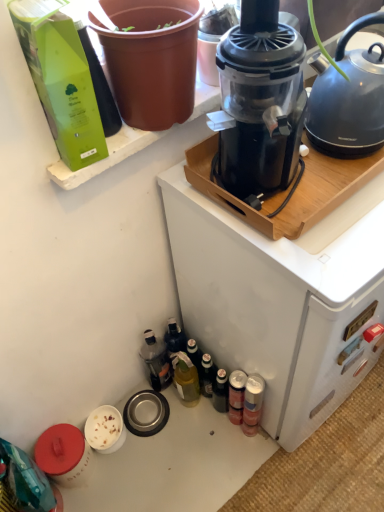
At what (x,y) coordinates should I click in order to perform the action: click on metallic silver can at lower right, which ranks as the third bottle in left-to-right order. Please return your answer as a coordinate pair (x, y). This screenshot has height=512, width=384. Looking at the image, I should click on (236, 396).

In order to face black plastic coffee maker at upper center, should I rotate leftwards or rightwards?

You should rotate right by 13.134 degrees.

At what (x,y) coordinates should I click in order to perform the action: click on transparent plastic juicer at upper center. Please return your answer as a coordinate pair (x, y). Image resolution: width=384 pixels, height=512 pixels. Looking at the image, I should click on (261, 99).

This screenshot has height=512, width=384. I want to click on translucent plastic bottle at lower left, the 1th bottle in the left-to-right sequence, so click(x=156, y=361).

Describe the element at coordinates (253, 403) in the screenshot. I see `metallic silver can at lower right, arranged as the first bottle when viewed from the right` at that location.

Measure the distance between point (194, 384) and camera.

They are 1.44 meters apart.

Identify the location of metallic silver can at lower right, the 2th bottle in the right-to-left sequence. (236, 396).

Between brown matte flowerpot at upper left and matte gray kettle at upper right, which one appears on the right side from the viewer's perspective?

From the viewer's perspective, matte gray kettle at upper right appears more on the right side.

Is brown matte flowerpot at upper left in contact with matte gray kettle at upper right?

brown matte flowerpot at upper left is not next to matte gray kettle at upper right, and they're not touching.

In the scene shown: Which is behind, brown matte flowerpot at upper left or matte gray kettle at upper right?

matte gray kettle at upper right is further from the camera.

From a real-world perspective, which is physically below, translucent plastic bottle at lower left, placed as the fourth bottle when sorted from right to left, or metallic silver can at lower right, the 2th bottle in the right-to-left sequence?

metallic silver can at lower right, the 2th bottle in the right-to-left sequence, is physically lower.

Can you tell me how much translucent plastic bottle at lower left, the 1th bottle in the left-to-right sequence, and metallic silver can at lower right, which ranks as the third bottle in left-to-right order, differ in facing direction?

0.00205 degrees separate the facing orientations of translucent plastic bottle at lower left, the 1th bottle in the left-to-right sequence, and metallic silver can at lower right, which ranks as the third bottle in left-to-right order.

Which is in front, translucent plastic bottle at lower left, placed as the fourth bottle when sorted from right to left, or metallic silver can at lower right, the 2th bottle in the right-to-left sequence?

metallic silver can at lower right, the 2th bottle in the right-to-left sequence, is closer to the camera.

From the image's perspective, is translucent plastic bottle at lower left, placed as the fourth bottle when sorted from right to left, over metallic silver can at lower right, which ranks as the third bottle in left-to-right order?

Yes.

Is metallic silver can at lower right, arranged as the first bottle when viewed from the right, touching translucent plastic bottle at lower left, placed as the fourth bottle when sorted from right to left?

No, metallic silver can at lower right, arranged as the first bottle when viewed from the right, is not making contact with translucent plastic bottle at lower left, placed as the fourth bottle when sorted from right to left.

Is metallic silver can at lower right, arranged as the first bottle when viewed from the right, shorter than translucent plastic bottle at lower left, the 1th bottle in the left-to-right sequence?

No, metallic silver can at lower right, arranged as the first bottle when viewed from the right, is not shorter than translucent plastic bottle at lower left, the 1th bottle in the left-to-right sequence.

Image resolution: width=384 pixels, height=512 pixels. In order to click on the 3rd bottle below when counting from the translucent plastic bottle at lower left, the 1th bottle in the left-to-right sequence (from the image's perspective) in this screenshot , I will do `click(253, 403)`.

Can you confirm if metallic silver can at lower right, arranged as the first bottle when viewed from the right, is thinner than translucent plastic bottle at lower left, placed as the fourth bottle when sorted from right to left?

Yes, metallic silver can at lower right, arranged as the first bottle when viewed from the right, is thinner than translucent plastic bottle at lower left, placed as the fourth bottle when sorted from right to left.

Can you confirm if brown matte flowerpot at upper left is bigger than transparent plastic juicer at upper center?

Incorrect, brown matte flowerpot at upper left is not larger than transparent plastic juicer at upper center.

In the scene shown: Can you confirm if brown matte flowerpot at upper left is positioned to the right of transparent plastic juicer at upper center?

Incorrect, brown matte flowerpot at upper left is not on the right side of transparent plastic juicer at upper center.

Is brown matte flowerpot at upper left positioned with its back to transparent plastic juicer at upper center?

No, transparent plastic juicer at upper center is not at the back of brown matte flowerpot at upper left.

In terms of width, does brown matte flowerpot at upper left look wider or thinner when compared to transparent plastic juicer at upper center?

Clearly, brown matte flowerpot at upper left has less width compared to transparent plastic juicer at upper center.

Is black plastic coffee maker at upper center behind translucent plastic bottle at lower left, the 1th bottle in the left-to-right sequence?

No.

Can you confirm if black plastic coffee maker at upper center is shorter than translucent plastic bottle at lower left, the 1th bottle in the left-to-right sequence?

No.

Is point (190, 318) positioned before point (144, 336)?

Yes, it is in front of point (144, 336).

Between black plastic coffee maker at upper center and translucent plastic bottle at lower left, placed as the fourth bottle when sorted from right to left, which one has larger width?

With larger width is black plastic coffee maker at upper center.

Who is shorter, metallic silver can at lower right, the 2th bottle in the right-to-left sequence, or matte gray kettle at upper right?

matte gray kettle at upper right is shorter.

Which is in front, point (233, 410) or point (363, 82)?

The point (363, 82) is in front.

Image resolution: width=384 pixels, height=512 pixels. In order to click on kettle lying on the right of metallic silver can at lower right, the 2th bottle in the right-to-left sequence in this screenshot , I will do `click(348, 98)`.

Can you confirm if metallic silver can at lower right, which ranks as the third bottle in left-to-right order, is wider than matte gray kettle at upper right?

No, metallic silver can at lower right, which ranks as the third bottle in left-to-right order, is not wider than matte gray kettle at upper right.

Which is nearer, (x=180, y=369) or (x=181, y=282)?

The point (x=181, y=282) is more forward.

At what (x,y) coordinates should I click in order to perform the action: click on appliance that appears above the green glass bottle at lower center, which is counted as the 2th bottle, starting from the left (from the image's perspective). Please return your answer as a coordinate pair (x, y). Looking at the image, I should click on (278, 295).

From a real-world perspective, is green glass bottle at lower center, which is counted as the 2th bottle, starting from the left, physically located above or below black plastic coffee maker at upper center?

green glass bottle at lower center, which is counted as the 2th bottle, starting from the left, is situated lower than black plastic coffee maker at upper center in the real world.

Is green glass bottle at lower center, which is counted as the 2th bottle, starting from the left, oriented away from black plastic coffee maker at upper center?

No, green glass bottle at lower center, which is counted as the 2th bottle, starting from the left, is not facing the opposite direction of black plastic coffee maker at upper center.

Locate an element on the screen. kettle to the right of brown matte flowerpot at upper left is located at coordinates (348, 98).

From the image's perspective, starting from the translucent plastic bottle at lower left, the 1th bottle in the left-to-right sequence, which bottle is the 2nd one below? Please provide its 2D coordinates.

[(236, 396)]

Based on their spatial positions, is brown matte flowerpot at upper left or matte gray kettle at upper right closer to black plastic coffee maker at upper center?

The object closer to black plastic coffee maker at upper center is matte gray kettle at upper right.

Estimate the real-world distances between objects in this image. Which object is further from black plastic coffee maker at upper center, brown matte flowerpot at upper left or metallic silver can at lower right, arranged as the first bottle when viewed from the right?

brown matte flowerpot at upper left lies further to black plastic coffee maker at upper center than the other object.

Looking at this image, considering their positions, is brown matte flowerpot at upper left positioned closer to matte gray kettle at upper right than transparent plastic juicer at upper center?

Based on the image, transparent plastic juicer at upper center appears to be nearer to matte gray kettle at upper right.

Considering their positions, is translucent plastic bottle at lower left, placed as the fourth bottle when sorted from right to left, positioned further to black plastic coffee maker at upper center than brown matte flowerpot at upper left?

translucent plastic bottle at lower left, placed as the fourth bottle when sorted from right to left.

Considering their positions, is matte gray kettle at upper right positioned closer to green glass bottle at lower center, which is counted as the 2th bottle, starting from the left, than transparent plastic juicer at upper center?

transparent plastic juicer at upper center lies closer to green glass bottle at lower center, which is counted as the 2th bottle, starting from the left, than the other object.

Considering their positions, is metallic silver can at lower right, arranged as the first bottle when viewed from the right, positioned closer to metallic silver can at lower right, the 2th bottle in the right-to-left sequence, than transparent plastic juicer at upper center?

Among the two, metallic silver can at lower right, arranged as the first bottle when viewed from the right, is located nearer to metallic silver can at lower right, the 2th bottle in the right-to-left sequence.

Considering their positions, is black plastic coffee maker at upper center positioned closer to metallic silver can at lower right, the 2th bottle in the right-to-left sequence, than metallic silver can at lower right, which is the 4th bottle in left-to-right order?

The object closer to metallic silver can at lower right, the 2th bottle in the right-to-left sequence, is metallic silver can at lower right, which is the 4th bottle in left-to-right order.

Looking at the image, which one is located further to black plastic coffee maker at upper center, translucent plastic bottle at lower left, placed as the fourth bottle when sorted from right to left, or transparent plastic juicer at upper center?

The object further to black plastic coffee maker at upper center is translucent plastic bottle at lower left, placed as the fourth bottle when sorted from right to left.

At what (x,y) coordinates should I click in order to perform the action: click on flowerpot that lies between matte gray kettle at upper right and metallic silver can at lower right, which ranks as the third bottle in left-to-right order, from top to bottom. Please return your answer as a coordinate pair (x, y). The width and height of the screenshot is (384, 512). Looking at the image, I should click on click(151, 59).

This screenshot has height=512, width=384. I want to click on bottle between translucent plastic bottle at lower left, the 1th bottle in the left-to-right sequence, and metallic silver can at lower right, the 2th bottle in the right-to-left sequence, so click(185, 378).

I want to click on appliance between matte gray kettle at upper right and metallic silver can at lower right, which ranks as the third bottle in left-to-right order, vertically, so click(x=278, y=295).

The width and height of the screenshot is (384, 512). I want to click on appliance that lies between brown matte flowerpot at upper left and metallic silver can at lower right, the 2th bottle in the right-to-left sequence, from top to bottom, so click(278, 295).